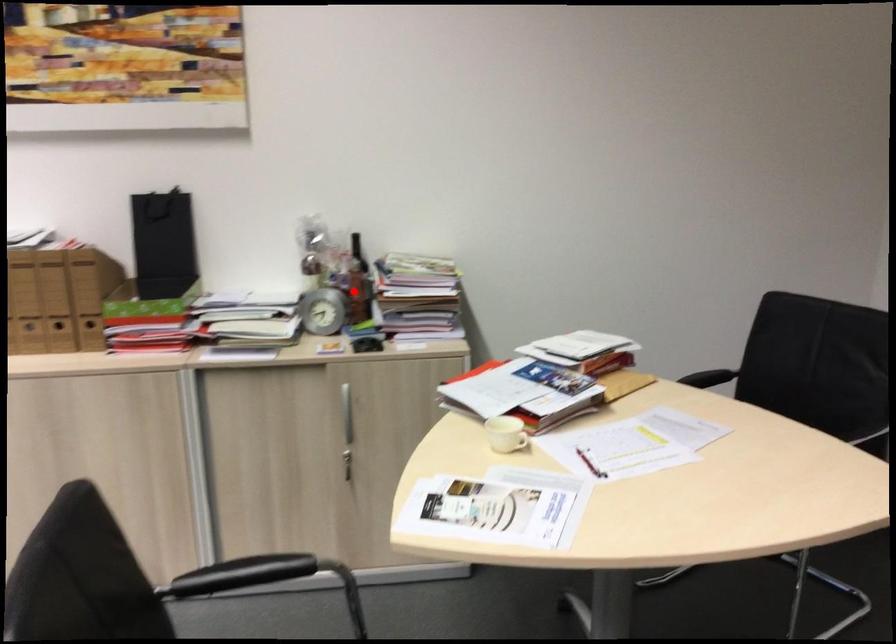
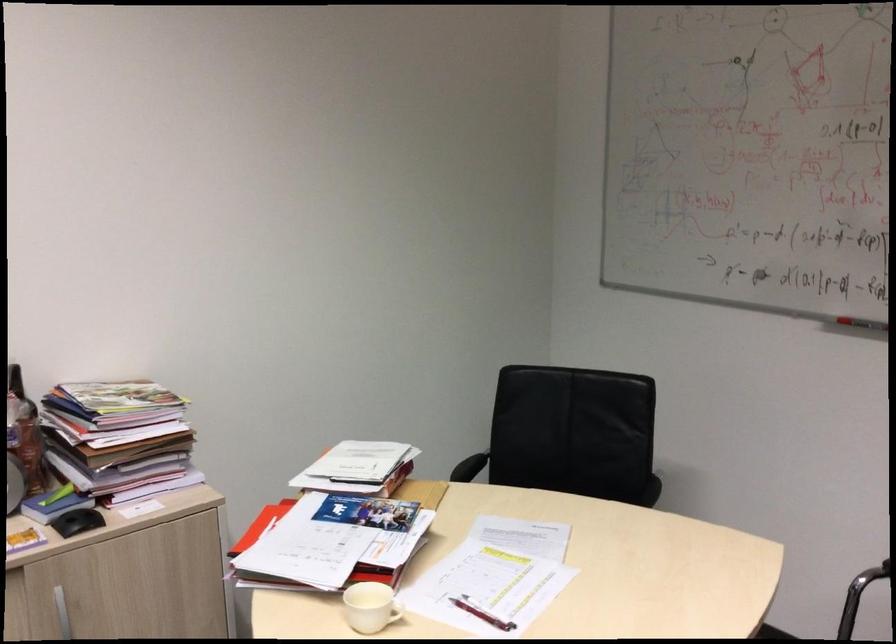
The point at the highlighted location is marked in the first image. Where is the corresponding point in the second image?

(23, 450)